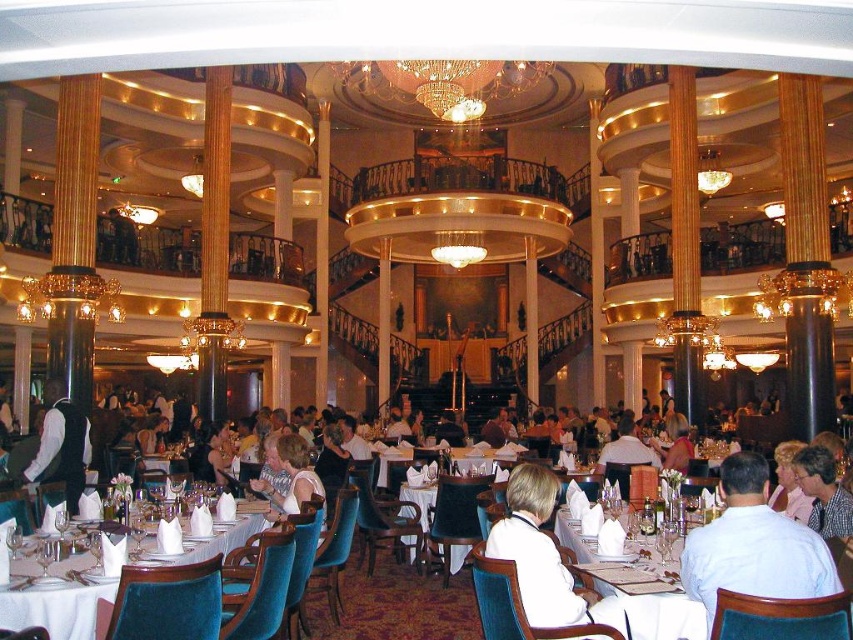
From the picture: You are a guest at the cruise ship dining area and want to take a photo of the white matte shirt at center and the white matte vest at left. Which one will appear closer to the camera in the photo?

The white matte shirt at center will appear closer to the camera in the photo because it is in front of the white matte vest at left.

You are a photographer standing at the camera position in the dining area. You want to take a closeup shot of the white matte shirt at center. Can you reach the subject without moving from your current position?

The white matte shirt at center is 17.80 meters away from camera. Since the subject is too far away, you cannot take a closeup shot without moving closer.

You are a guest at this elegant dining area and notice two items at the center of the scene. Which one is closer to you, the white matte shirt at center or the white cloth at center?

The white matte shirt at center is closer to you because the white cloth at center is positioned behind it.